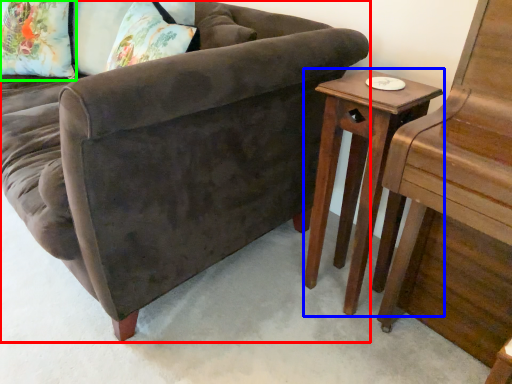
Question: Considering the real-world distances, which object is farthest from studio couch (highlighted by a red box)? table (highlighted by a blue box) or pillow (highlighted by a green box)?

Choices:
 (A) table
 (B) pillow

Answer: (B)